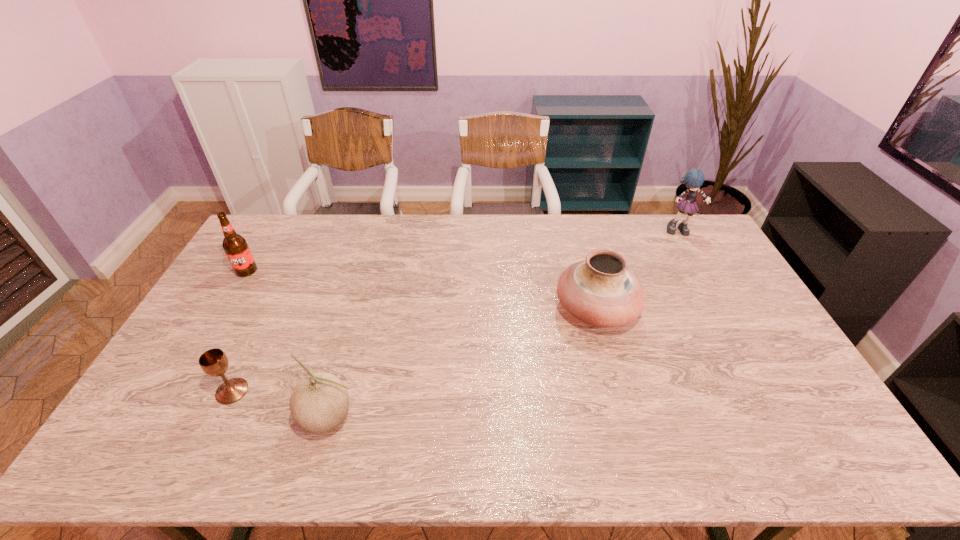
In order to click on the rightmost object in this screenshot , I will do `click(693, 180)`.

Find the location of a particular element. The height and width of the screenshot is (540, 960). the farthest object is located at coordinates (693, 180).

Find the location of a particular element. The width and height of the screenshot is (960, 540). root beer is located at coordinates (235, 246).

Identify the location of the fourth nearest object. (235, 246).

Identify the location of the third farthest object. (599, 291).

The width and height of the screenshot is (960, 540). I want to click on pottery, so click(x=599, y=291).

Find the location of a particular element. the third object from left to right is located at coordinates (319, 403).

Find the location of `the second object from left to right`. the second object from left to right is located at coordinates (214, 362).

The image size is (960, 540). Find the location of `chalice`. chalice is located at coordinates (214, 362).

Locate an element on the screen. free space located 0.230m on the front-facing side of the farthest object is located at coordinates (708, 278).